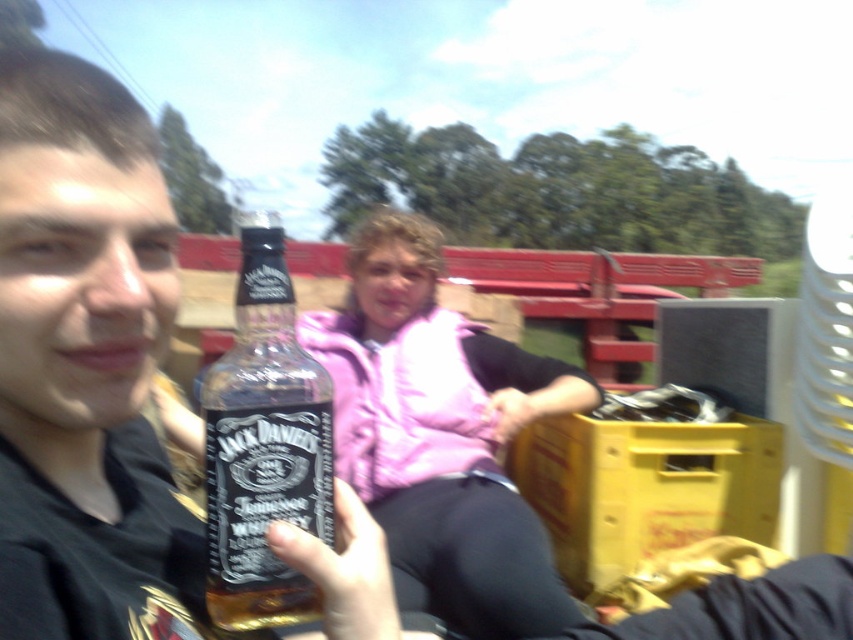
Measure the distance from pink fabric vest at center to clear glass bottle at center.

pink fabric vest at center is 34.44 inches away from clear glass bottle at center.

Is point (486, 451) closer to camera compared to point (254, 541)?

No, it is not.

Consider the image. Who is more distant from viewer, (x=378, y=289) or (x=291, y=509)?

The point (x=378, y=289) is more distant.

I want to click on pink fabric vest at center, so tap(440, 435).

Looking at this image, who is higher up, matte glass bottle at center or clear glass bottle at center?

matte glass bottle at center

Does matte glass bottle at center appear on the left side of clear glass bottle at center?

Correct, you'll find matte glass bottle at center to the left of clear glass bottle at center.

Which is in front, point (62, 132) or point (222, 390)?

Point (62, 132) is in front.

Locate an element on the screen. matte glass bottle at center is located at coordinates (85, 364).

Between matte glass bottle at center and pink fabric vest at center, which one is positioned lower?

pink fabric vest at center

You are a GUI agent. You are given a task and a screenshot of the screen. Output one action in this format:
    pyautogui.click(x=<x>, y=<y>)
    Task: Click on the matte glass bottle at center
    Image resolution: width=853 pixels, height=640 pixels.
    Given the screenshot: What is the action you would take?
    pyautogui.click(x=85, y=364)

This screenshot has height=640, width=853. Find the location of `matte glass bottle at center`. matte glass bottle at center is located at coordinates pos(85,364).